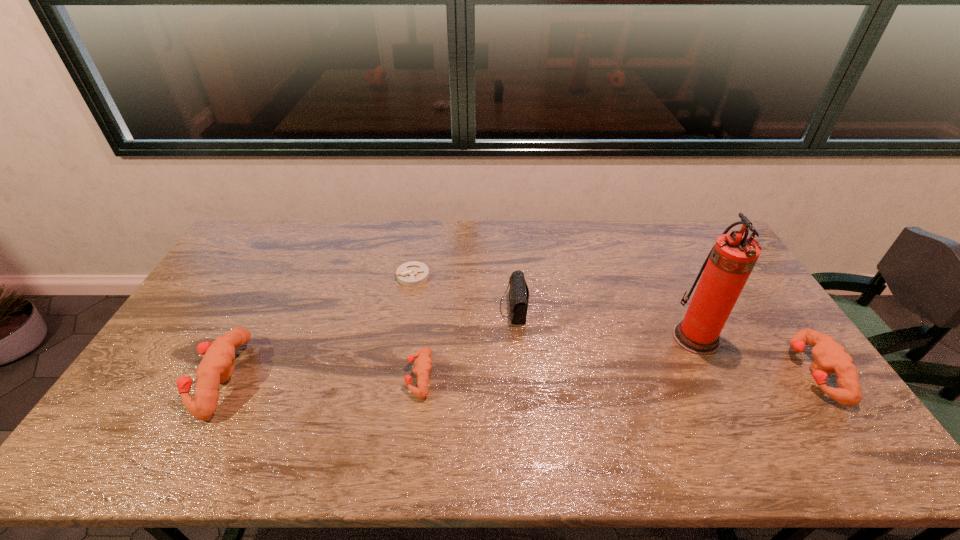
I want to click on blank space located with the gloves of the leftmost object facing forward, so click(154, 378).

At what (x,y) coordinates should I click in order to perform the action: click on free space located with the gloves of the second shortest object facing forward. Please return your answer as a coordinate pair (x, y). The image size is (960, 540). Looking at the image, I should click on (381, 376).

The image size is (960, 540). What are the coordinates of `free space located 0.200m with the gloves of the second shortest object facing forward` in the screenshot? It's located at (333, 376).

Image resolution: width=960 pixels, height=540 pixels. Identify the location of vacant region located 0.250m with the gloves of the second shortest object facing forward. (315, 376).

Identify the location of free region located 0.240m with the gloves of the rightmost object facing forward. This screenshot has height=540, width=960. (707, 372).

At what (x,y) coordinates should I click in order to perform the action: click on free point located 0.270m with the gloves of the rightmost object facing forward. Please return your answer as a coordinate pair (x, y). The width and height of the screenshot is (960, 540). Looking at the image, I should click on (696, 372).

The width and height of the screenshot is (960, 540). I want to click on free spot located with the gloves of the rightmost object facing forward, so (x=674, y=372).

Identify the location of vacant space located 0.290m on the right of the ashtray. The height and width of the screenshot is (540, 960). click(x=514, y=276).

Find the location of `vacant space positioned on the front flap of the clutch bag`. vacant space positioned on the front flap of the clutch bag is located at coordinates (456, 308).

Locate an element on the screen. The image size is (960, 540). free space located 0.210m on the front flap of the clutch bag is located at coordinates (433, 308).